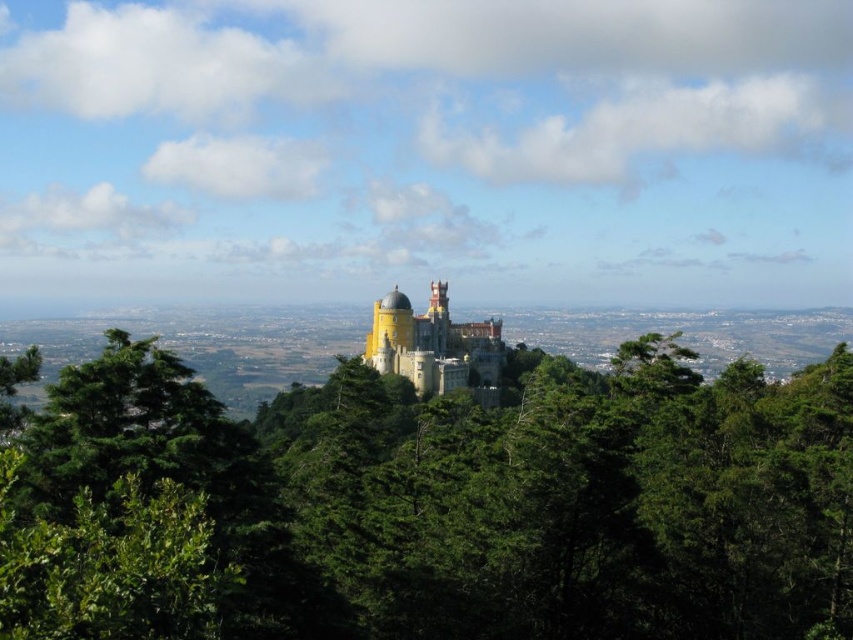
Question: Is green leafy tree at center closer to the viewer compared to yellow matte castle at center?

Choices:
 (A) yes
 (B) no

Answer: (A)

Question: Can you confirm if green leafy tree at center is positioned to the left of yellow matte castle at center?

Choices:
 (A) no
 (B) yes

Answer: (A)

Question: Among these points, which one is farthest from the camera?

Choices:
 (A) (486, 387)
 (B) (671, 442)

Answer: (B)

Question: Can you confirm if green leafy tree at center is positioned below yellow matte castle at center?

Choices:
 (A) yes
 (B) no

Answer: (A)